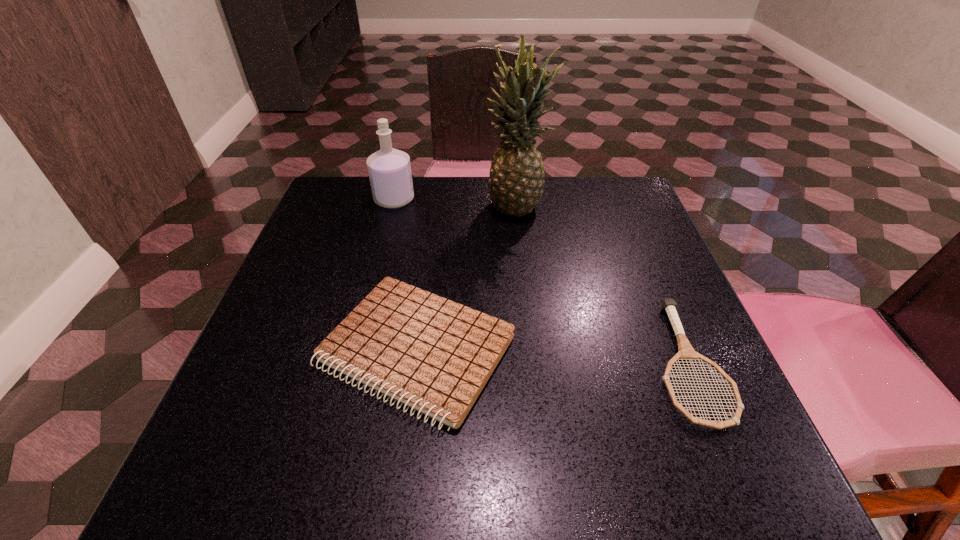
Find the location of `perfume that is at the left edge`. perfume that is at the left edge is located at coordinates (389, 169).

This screenshot has height=540, width=960. I want to click on notebook located in the left edge section of the desktop, so click(x=434, y=355).

In order to click on object that is positioned at the right edge in this screenshot , I will do `click(686, 352)`.

Find the location of a particular element. This screenshot has height=540, width=960. object that is at the far left corner is located at coordinates (389, 169).

Identify the location of free location at the far edge of the desktop. This screenshot has height=540, width=960. (448, 222).

The image size is (960, 540). In the image, there is a desktop. In order to click on vacant space at the near edge in this screenshot , I will do `click(642, 454)`.

In the image, there is a desktop. At what (x,y) coordinates should I click in order to perform the action: click on free space at the left edge. Please return your answer as a coordinate pair (x, y). This screenshot has width=960, height=540. Looking at the image, I should click on (335, 296).

Locate an element on the screen. vacant space at the right edge of the desktop is located at coordinates (614, 311).

Where is `free point at the far left corner`? The image size is (960, 540). free point at the far left corner is located at coordinates (344, 183).

This screenshot has width=960, height=540. Find the location of `vacant point at the near left corner`. vacant point at the near left corner is located at coordinates (233, 436).